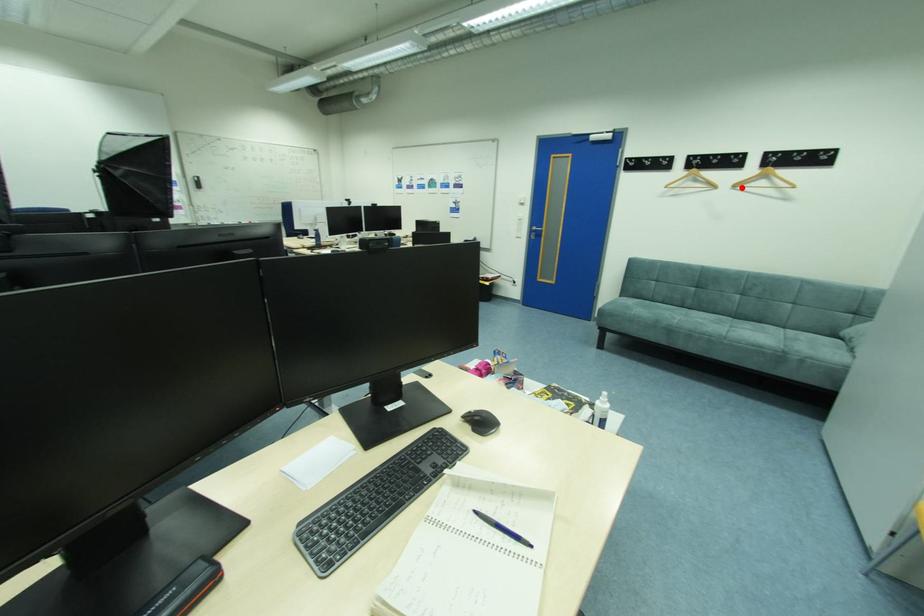
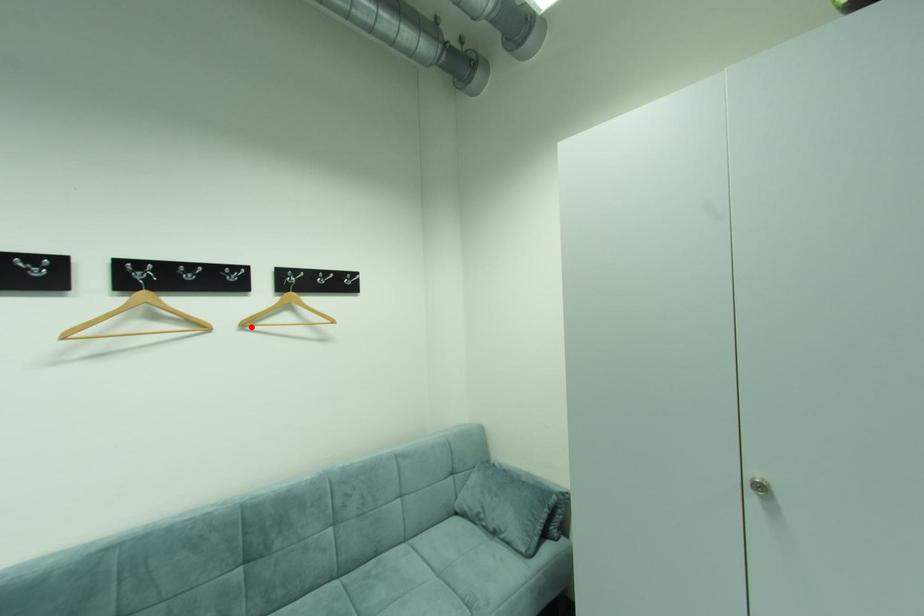
I am providing you with two images of the same scene from different viewpoints. A red point is marked on the first image and another point is marked on the second image. Are the points marked in image1 and image2 representing the same 3D position?

Yes